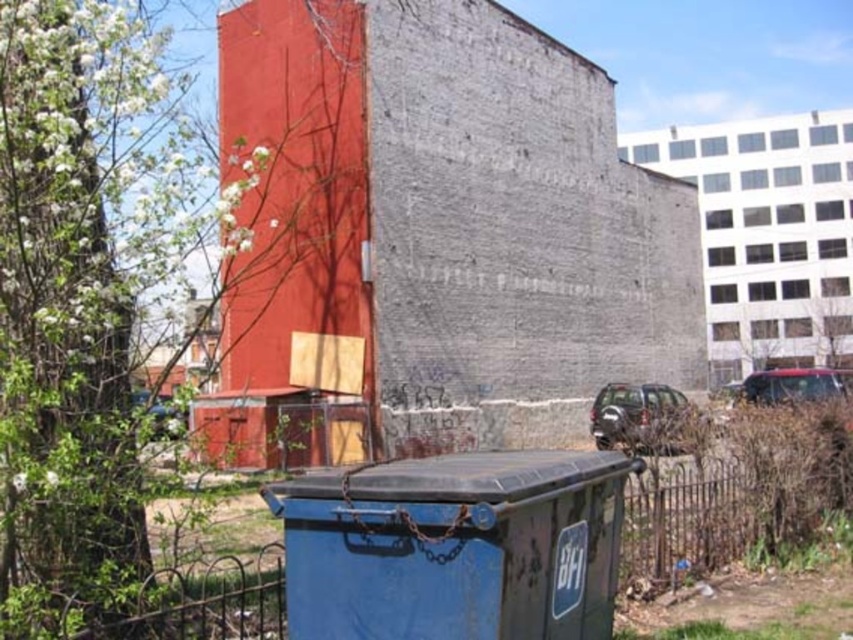
This screenshot has height=640, width=853. Describe the element at coordinates (79, 300) in the screenshot. I see `green leafy tree at left` at that location.

Does green leafy tree at left have a smaller size compared to rusty blue container at center?

Incorrect, green leafy tree at left is not smaller in size than rusty blue container at center.

Who is more distant from viewer, (x=125, y=16) or (x=531, y=483)?

The point (x=125, y=16) is more distant.

Locate an element on the screen. This screenshot has height=640, width=853. green leafy tree at left is located at coordinates (79, 300).

Between point (584, 563) and point (759, 365), which one is positioned in front?

Point (584, 563) is more forward.

You are a GUI agent. You are given a task and a screenshot of the screen. Output one action in this format:
    pyautogui.click(x=<x>, y=<y>)
    Task: Click on the rusty blue container at center
    
    Given the screenshot: What is the action you would take?
    pyautogui.click(x=454, y=547)

Which is more to the right, rusty blue container at center or green leafy tree at upper right?

green leafy tree at upper right

Who is more forward, (607, 608) or (811, 314)?

Positioned in front is point (607, 608).

Where is `rusty blue container at center`? This screenshot has height=640, width=853. rusty blue container at center is located at coordinates (454, 547).